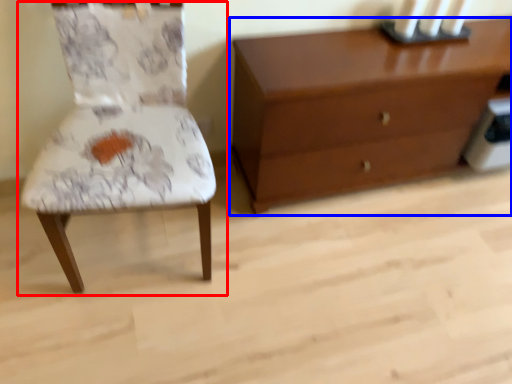
Question: Among these objects, which one is nearest to the camera, chair (highlighted by a red box) or chest of drawers (highlighted by a blue box)?

Choices:
 (A) chair
 (B) chest of drawers

Answer: (A)